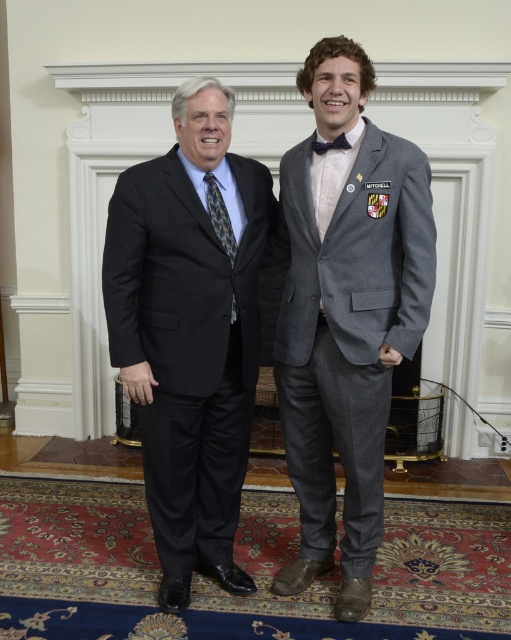
Is black wool suit at center to the left of patterned silk tie at center from the viewer's perspective?

Correct, you'll find black wool suit at center to the left of patterned silk tie at center.

The image size is (511, 640). In order to click on black wool suit at center in this screenshot , I will do `click(188, 346)`.

Does matte black suit at left appear on the left side of black wool suit at center?

In fact, matte black suit at left is to the right of black wool suit at center.

Does matte black suit at left appear under black wool suit at center?

No, matte black suit at left is not below black wool suit at center.

Image resolution: width=511 pixels, height=640 pixels. What are the coordinates of `matte black suit at left` in the screenshot? It's located at (192, 330).

Identify the location of matte black suit at left. Image resolution: width=511 pixels, height=640 pixels. (192, 330).

Does gray wool suit at right have a greater height compared to patterned silk tie at center?

Yes.

The width and height of the screenshot is (511, 640). What do you see at coordinates (346, 314) in the screenshot? I see `gray wool suit at right` at bounding box center [346, 314].

Find the location of `gray wool suit at right`. gray wool suit at right is located at coordinates (346, 314).